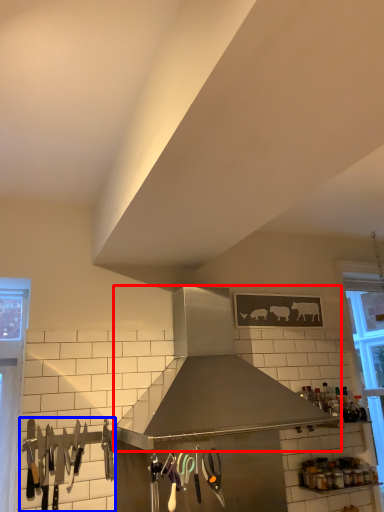
Question: Which of the following is the closest to the observer, kitchen appliance (highlighted by a red box) or silverware (highlighted by a blue box)?

Choices:
 (A) kitchen appliance
 (B) silverware

Answer: (A)